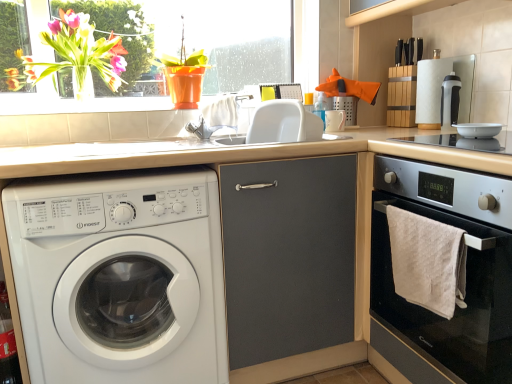
Question: Could you tell me if transparent glass window at upper left is facing white plastic washing machine at left?

Choices:
 (A) no
 (B) yes

Answer: (A)

Question: Is transparent glass window at upper left not close to white plastic washing machine at left?

Choices:
 (A) yes
 (B) no

Answer: (A)

Question: Does transparent glass window at upper left contain white plastic washing machine at left?

Choices:
 (A) no
 (B) yes

Answer: (A)

Question: From the image's perspective, is transparent glass window at upper left beneath white plastic washing machine at left?

Choices:
 (A) no
 (B) yes

Answer: (A)

Question: Does transparent glass window at upper left appear on the left side of white plastic washing machine at left?

Choices:
 (A) no
 (B) yes

Answer: (A)

Question: From the image's perspective, is white plastic washing machine at left located above or below black plastic coffee machine at upper right?

Choices:
 (A) below
 (B) above

Answer: (A)

Question: Is point (77, 269) positioned closer to the camera than point (449, 97)?

Choices:
 (A) farther
 (B) closer

Answer: (B)

Question: Based on their positions, is white plastic washing machine at left located to the left or right of black plastic coffee machine at upper right?

Choices:
 (A) left
 (B) right

Answer: (A)

Question: Considering their positions, is white plastic washing machine at left located in front of or behind black plastic coffee machine at upper right?

Choices:
 (A) behind
 (B) front

Answer: (B)

Question: From a real-world perspective, is translucent glass vase at upper left above or below white glossy bowl at upper right?

Choices:
 (A) above
 (B) below

Answer: (A)

Question: Considering the positions of point (114, 84) and point (476, 130), is point (114, 84) closer or farther from the camera than point (476, 130)?

Choices:
 (A) closer
 (B) farther

Answer: (B)

Question: Is translucent glass vase at upper left taller or shorter than white glossy bowl at upper right?

Choices:
 (A) short
 (B) tall

Answer: (B)

Question: Would you say translucent glass vase at upper left is to the left or to the right of white glossy bowl at upper right in the picture?

Choices:
 (A) left
 (B) right

Answer: (A)

Question: Which is correct: matte gray cabinet at center is inside white plastic washing machine at left, or outside of it?

Choices:
 (A) outside
 (B) inside

Answer: (A)

Question: From a real-world perspective, relative to white plastic washing machine at left, is matte gray cabinet at center vertically above or below?

Choices:
 (A) above
 (B) below

Answer: (B)